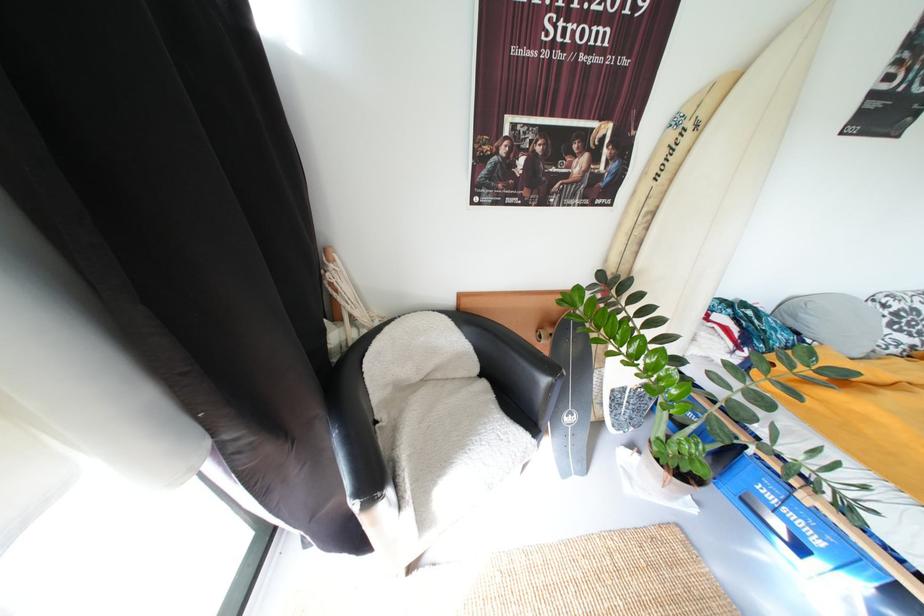
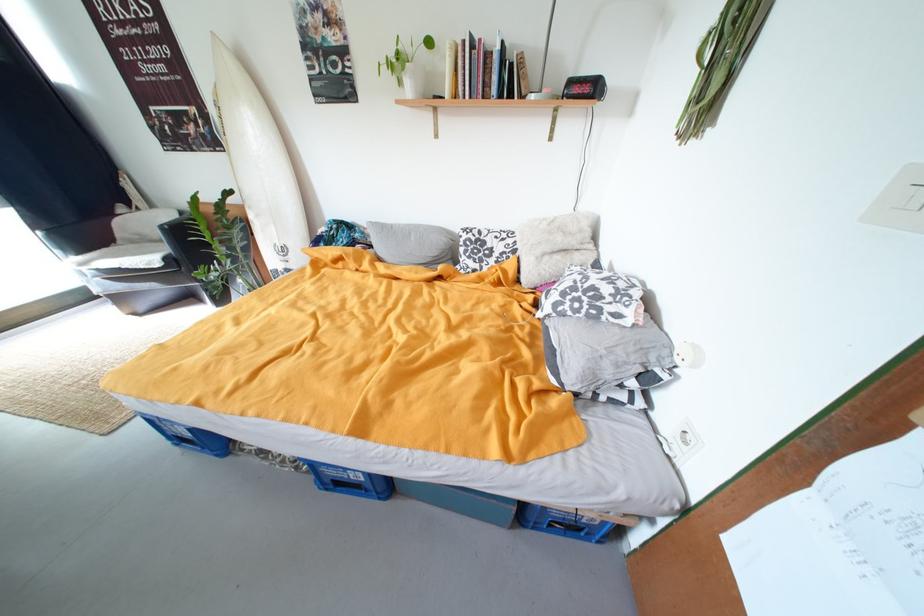
Where in the second image is the point corresponding to pixel 695 129 from the first image?

(225, 108)